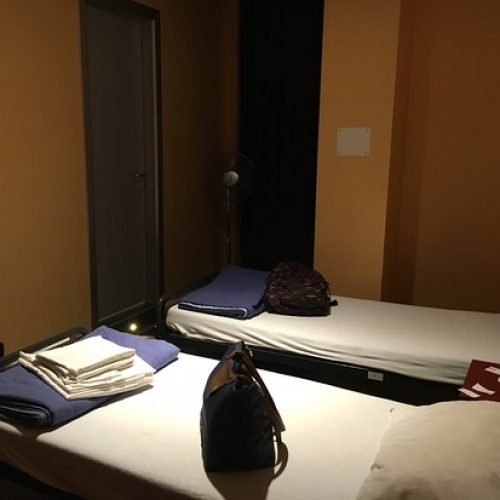
Identify the location of sheet set. (92, 358).